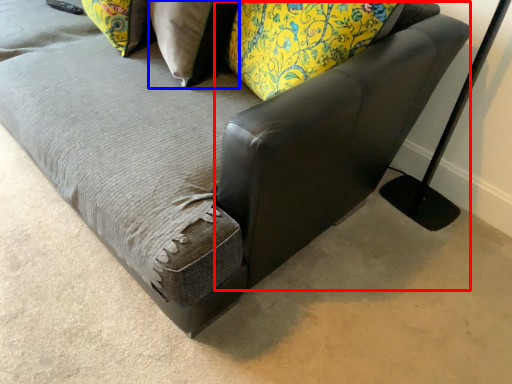
Question: Which object appears farthest to the camera in this image, swivel chair (highlighted by a red box) or pillow (highlighted by a blue box)?

Choices:
 (A) swivel chair
 (B) pillow

Answer: (B)